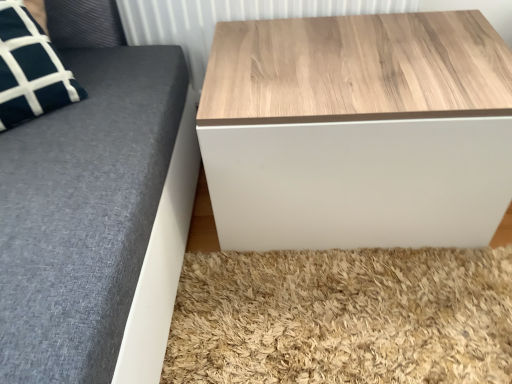
In order to click on wooden/textured table at upper right in this screenshot , I will do `click(357, 131)`.

Describe the element at coordinates (357, 131) in the screenshot. I see `wooden/textured table at upper right` at that location.

Measure the distance between point (170, 27) and camera.

They are 3.34 feet apart.

Describe the element at coordinates (227, 20) in the screenshot. I see `wooden panel at upper center` at that location.

I want to click on wooden panel at upper center, so click(x=227, y=20).

In order to face wooden panel at upper center, should I rotate leftwards or rightwards?

A 1.761 degree turn to the right will do.

The height and width of the screenshot is (384, 512). I want to click on wooden/textured table at upper right, so click(x=357, y=131).

Visually, is wooden panel at upper center positioned to the left or to the right of wooden/textured table at upper right?

wooden panel at upper center is to the left of wooden/textured table at upper right.

Is wooden panel at upper center closer to camera compared to wooden/textured table at upper right?

No, it is not.

Which is closer, (330, 6) or (359, 43)?

Point (330, 6).

From the image's perspective, between wooden panel at upper center and wooden/textured table at upper right, who is located below?

wooden/textured table at upper right.

From a real-world perspective, is wooden panel at upper center under wooden/textured table at upper right?

No.

Between wooden panel at upper center and wooden/textured table at upper right, which one has smaller width?

wooden panel at upper center is thinner.

Considering the sizes of wooden panel at upper center and wooden/textured table at upper right in the image, is wooden panel at upper center taller or shorter than wooden/textured table at upper right?

Considering their sizes, wooden panel at upper center has less height than wooden/textured table at upper right.

From the picture: Does wooden panel at upper center have a smaller size compared to wooden/textured table at upper right?

Correct, wooden panel at upper center occupies less space than wooden/textured table at upper right.

Is wooden panel at upper center outside of wooden/textured table at upper right?

wooden panel at upper center lies outside wooden/textured table at upper right's area.

Is wooden panel at upper center not near wooden/textured table at upper right?

No, wooden panel at upper center is not far away from wooden/textured table at upper right.

Does wooden panel at upper center turn towards wooden/textured table at upper right?

Yes, wooden panel at upper center is oriented towards wooden/textured table at upper right.

Where is `table that is below the wooden panel at upper center (from the image's perspective)`? table that is below the wooden panel at upper center (from the image's perspective) is located at coordinates coord(357,131).

Is wooden/textured table at upper right to the right of wooden panel at upper center from the viewer's perspective?

Yes, wooden/textured table at upper right is to the right of wooden panel at upper center.

Is wooden/textured table at upper right closer to camera compared to wooden panel at upper center?

Yes, it is in front of wooden panel at upper center.

Does point (253, 99) lie behind point (357, 2)?

No, it is not.

From the image's perspective, which is below, wooden/textured table at upper right or wooden panel at upper center?

wooden/textured table at upper right appears lower in the image.

From a real-world perspective, is wooden/textured table at upper right physically below wooden panel at upper center?

Correct, in the physical world, wooden/textured table at upper right is lower than wooden panel at upper center.

Can you confirm if wooden/textured table at upper right is thinner than wooden panel at upper center?

No.

Between wooden/textured table at upper right and wooden panel at upper center, which one has more height?

Standing taller between the two is wooden/textured table at upper right.

Is wooden/textured table at upper right smaller than wooden panel at upper center?

No.

Is wooden/textured table at upper right located outside wooden panel at upper center?

Yes, wooden/textured table at upper right is located beyond the bounds of wooden panel at upper center.

Is wooden/textured table at upper right in contact with wooden panel at upper center?

There is a gap between wooden/textured table at upper right and wooden panel at upper center.

Is wooden/textured table at upper right aimed at wooden panel at upper center?

No, wooden/textured table at upper right does not turn towards wooden panel at upper center.

Can you tell me how much wooden/textured table at upper right and wooden panel at upper center differ in facing direction?

0.000664 degrees separate the facing orientations of wooden/textured table at upper right and wooden panel at upper center.

Find the location of a particular element. The height and width of the screenshot is (384, 512). table lying on the right of wooden panel at upper center is located at coordinates point(357,131).

You are a GUI agent. You are given a task and a screenshot of the screen. Output one action in this format:
    pyautogui.click(x=<x>, y=<y>)
    Task: Click on the table located in front of the wooden panel at upper center
    
    Given the screenshot: What is the action you would take?
    pyautogui.click(x=357, y=131)

Identify the location of table located underneath the wooden panel at upper center (from a real-world perspective). This screenshot has width=512, height=384. (357, 131).